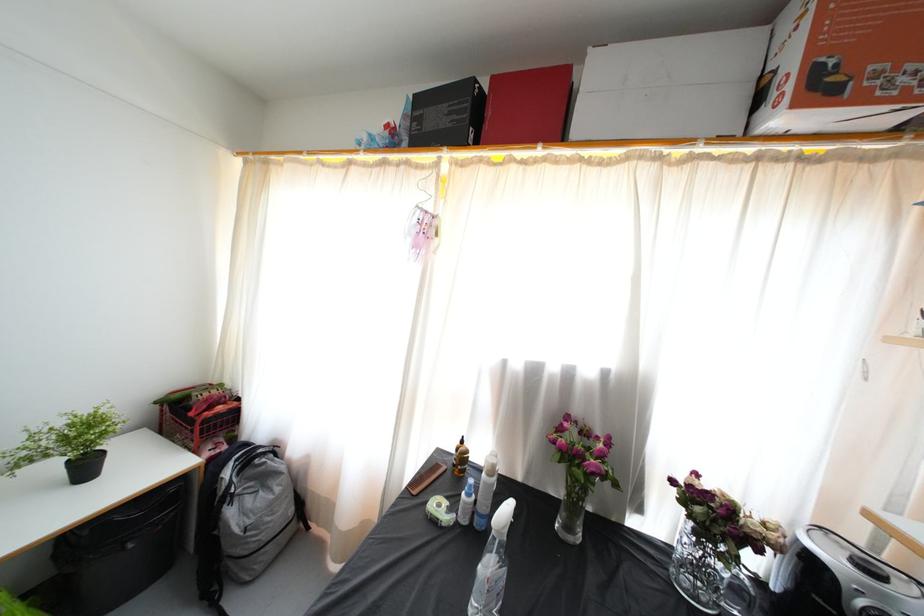
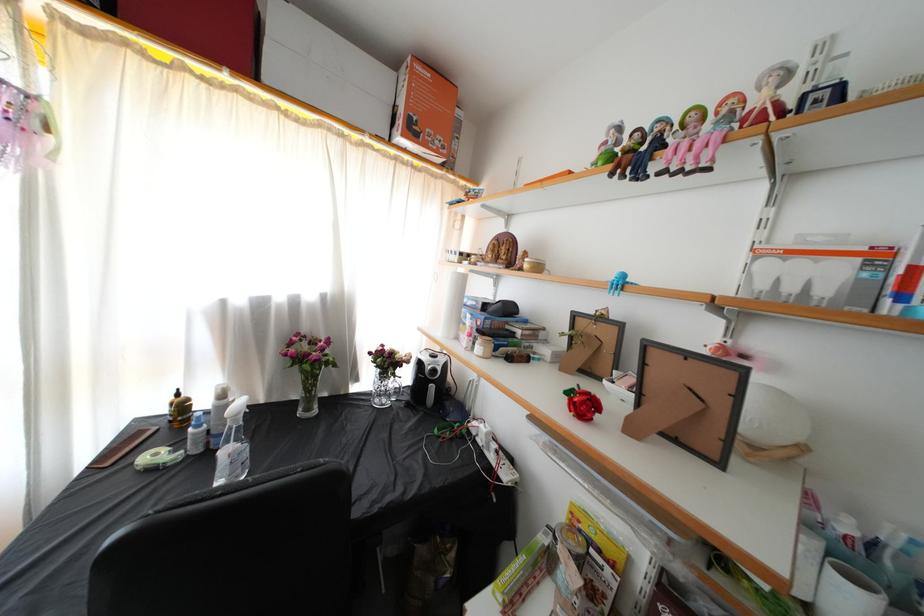
Locate, in the second image, the point that corresponds to point 442,472 in the first image.

(144, 439)